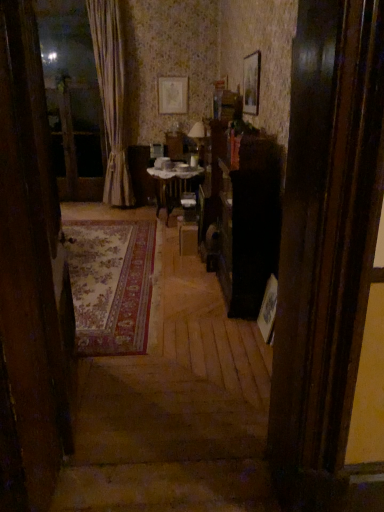
The image size is (384, 512). Identify the location of vacant space underneath carpeted rug at left (from a real-world perspective). (87, 393).